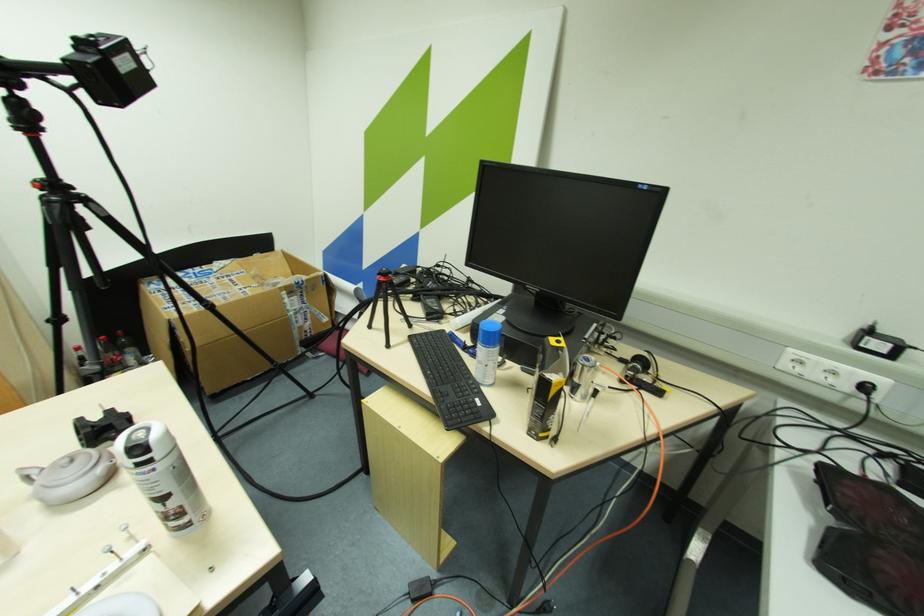
Where would you lift the grey teapot lid? Please return your answer as a coordinate pair (x, y).

(28, 474)